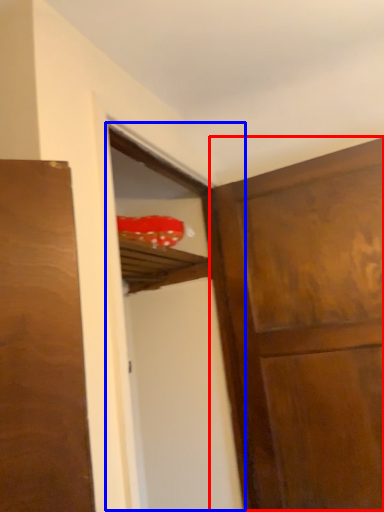
Question: Which of the following is the farthest to the observer, door (highlighted by a red box) or screen door (highlighted by a blue box)?

Choices:
 (A) door
 (B) screen door

Answer: (A)